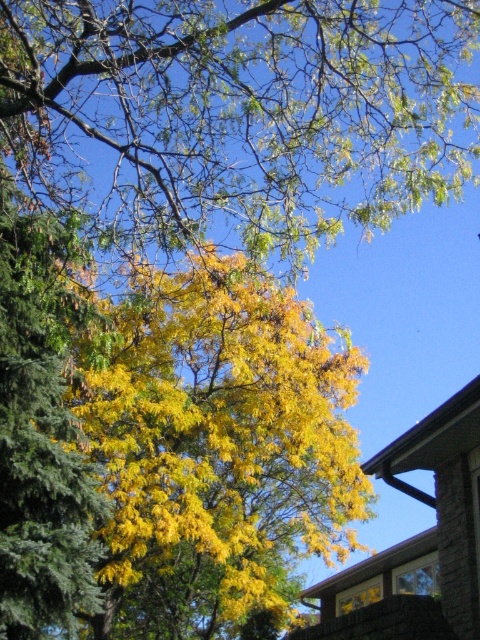
Question: Among these objects, which one is farthest from the camera?

Choices:
 (A) green leafy tree at upper center
 (B) yellow-green leaves at upper left

Answer: (B)

Question: Can you confirm if yellow leafy tree at center is smaller than yellow-green leaves at upper left?

Choices:
 (A) no
 (B) yes

Answer: (A)

Question: Can you confirm if green leafy tree at upper center is positioned below yellow leafy tree at center?

Choices:
 (A) yes
 (B) no

Answer: (B)

Question: Which object appears farthest from the camera in this image?

Choices:
 (A) yellow leafy tree at center
 (B) green leafy tree at upper center

Answer: (A)

Question: Among these objects, which one is farthest from the camera?

Choices:
 (A) yellow-green leaves at upper left
 (B) green leafy tree at upper center

Answer: (A)

Question: Is yellow leafy tree at center wider than yellow-green leaves at upper left?

Choices:
 (A) yes
 (B) no

Answer: (A)